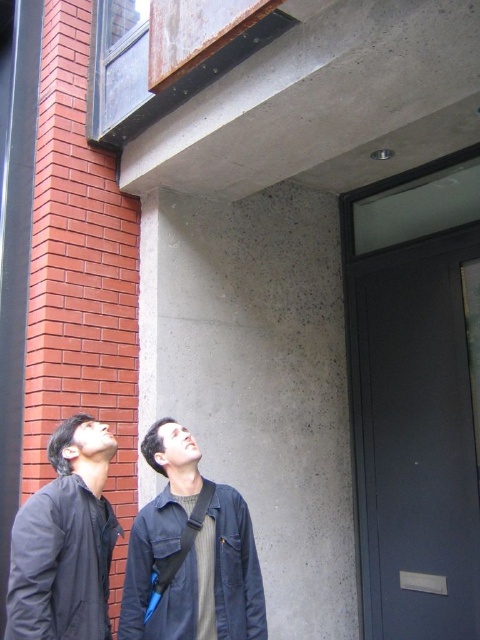
Question: Which point is closer to the camera?

Choices:
 (A) dark blue cotton jacket at lower center
 (B) dark blue jacket at lower left

Answer: (B)

Question: Is dark blue jacket at lower left positioned before dark blue cotton jacket at lower center?

Choices:
 (A) yes
 (B) no

Answer: (A)

Question: Does dark blue jacket at lower left have a greater width compared to dark blue cotton jacket at lower center?

Choices:
 (A) no
 (B) yes

Answer: (A)

Question: Which of the following is the farthest from the observer?

Choices:
 (A) (x=137, y=538)
 (B) (x=84, y=632)

Answer: (A)

Question: From the image, what is the correct spatial relationship of dark blue jacket at lower left in relation to dark blue cotton jacket at lower center?

Choices:
 (A) left
 (B) right

Answer: (A)